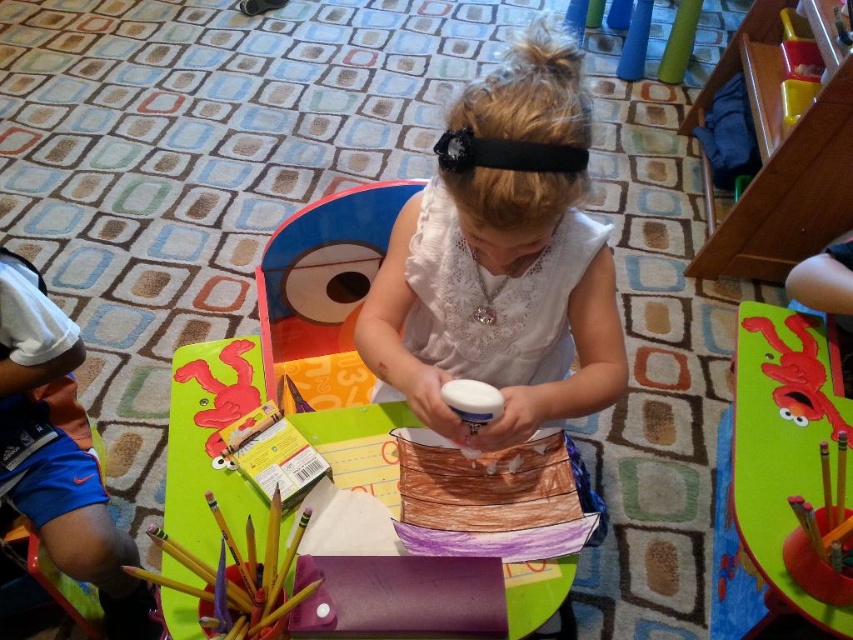
Is matte plastic toy at center taller than chocolate cake at center?

Correct, matte plastic toy at center is much taller as chocolate cake at center.

What do you see at coordinates (323, 291) in the screenshot?
I see `matte plastic toy at center` at bounding box center [323, 291].

Find the location of a particular element. matte plastic toy at center is located at coordinates (323, 291).

Is point (396, 422) less distant than point (376, 186)?

Yes, point (396, 422) is closer to viewer.

Identify the location of wooden table at center. (210, 442).

Describe the element at coordinates (210, 442) in the screenshot. I see `wooden table at center` at that location.

The image size is (853, 640). What are the coordinates of `wooden table at center` in the screenshot? It's located at (210, 442).

Does white lace dress at center appear on the left side of chocolate cake at center?

Correct, you'll find white lace dress at center to the left of chocolate cake at center.

Can you confirm if white lace dress at center is taller than chocolate cake at center?

Yes, white lace dress at center is taller than chocolate cake at center.

Which is behind, point (592, 508) or point (561, 484)?

The point (592, 508) is more distant.

You are a GUI agent. You are given a task and a screenshot of the screen. Output one action in this format:
    pyautogui.click(x=<x>, y=<y>)
    Task: Click on the white lace dress at center
    Image resolution: width=853 pixels, height=640 pixels.
    Given the screenshot: What is the action you would take?
    coord(502,260)